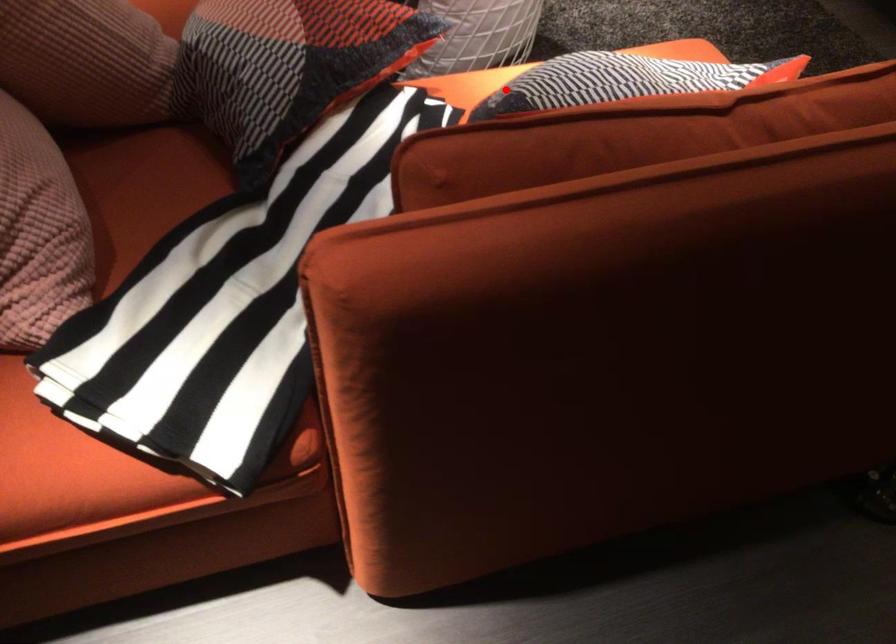
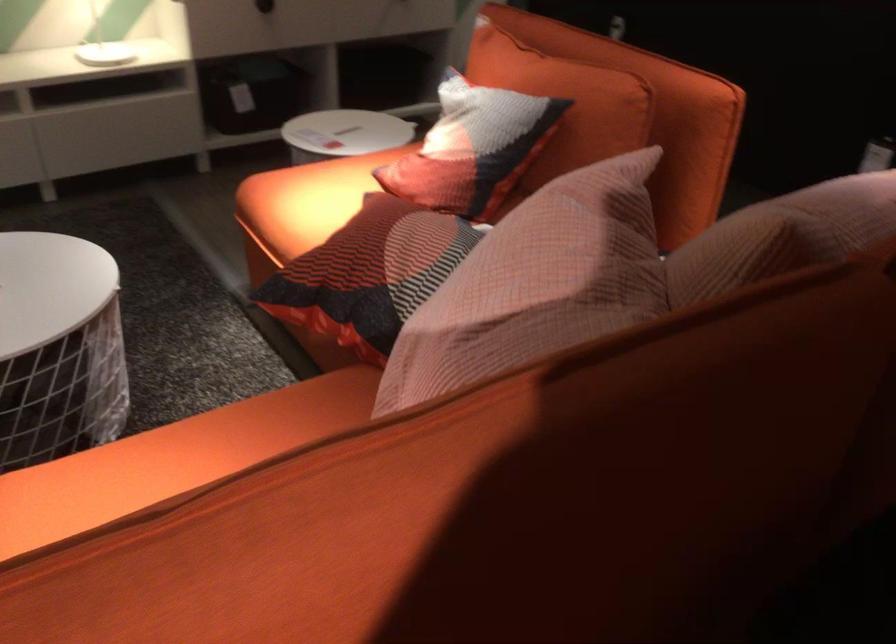
The point at the highlighted location is marked in the first image. Where is the corresponding point in the second image?

(564, 102)